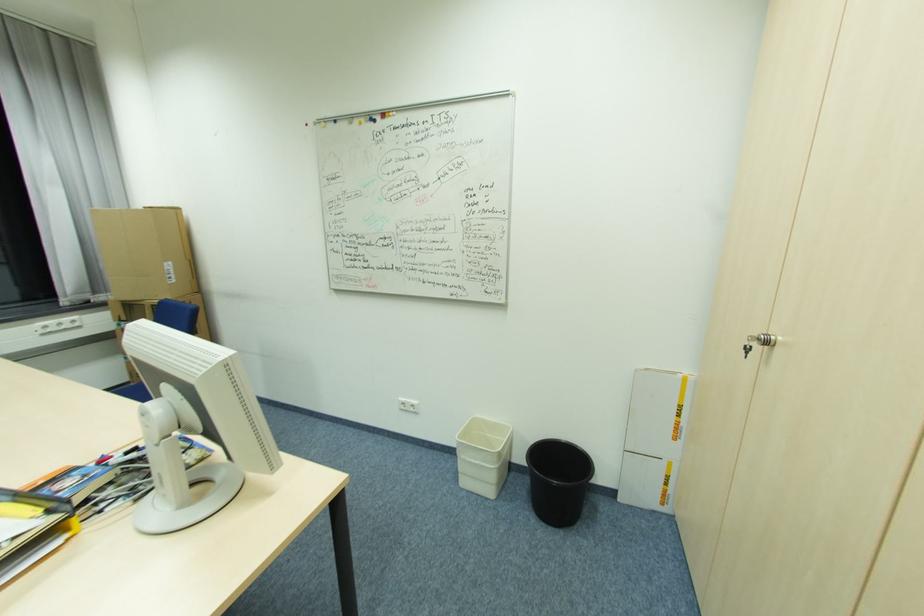
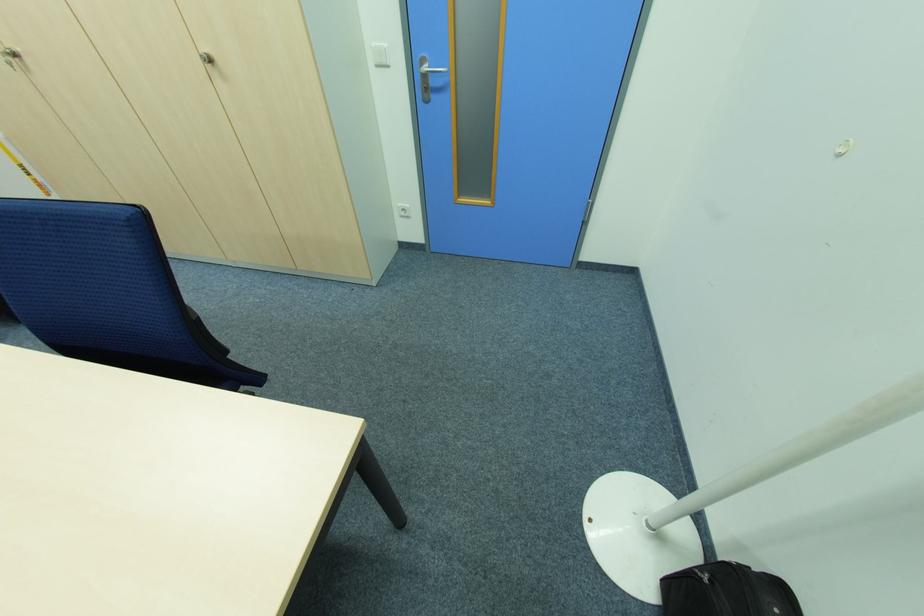
In the second image, find the point that corresponds to [752,351] in the first image.

(14, 65)